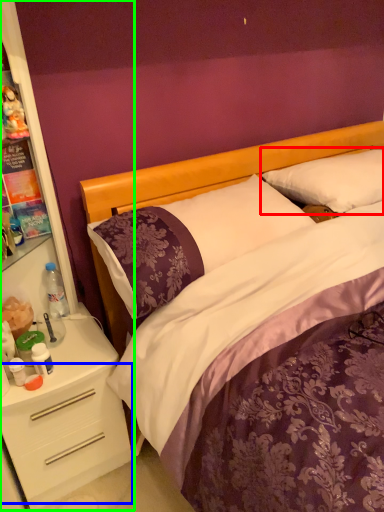
Question: Based on their relative distances, which object is nearer to pillow (highlighted by a red box)? Choose from drawer (highlighted by a blue box) and dresser (highlighted by a green box).

Choices:
 (A) drawer
 (B) dresser

Answer: (B)